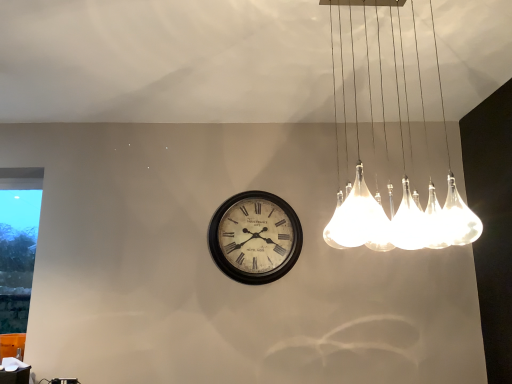
Question: From a real-world perspective, is vintage white clock at center above or below transparent glass window at left?

Choices:
 (A) below
 (B) above

Answer: (B)

Question: From the image's perspective, relative to transparent glass window at left, is vintage white clock at center above or below?

Choices:
 (A) above
 (B) below

Answer: (A)

Question: Which of these objects is positioned closest to the vintage white clock at center?

Choices:
 (A) white matte table at lower left
 (B) clear glass pendant lights at upper right
 (C) transparent glass window at left

Answer: (B)

Question: Which is nearer to the transparent glass window at left?

Choices:
 (A) white matte table at lower left
 (B) vintage white clock at center
 (C) clear glass pendant lights at upper right

Answer: (A)